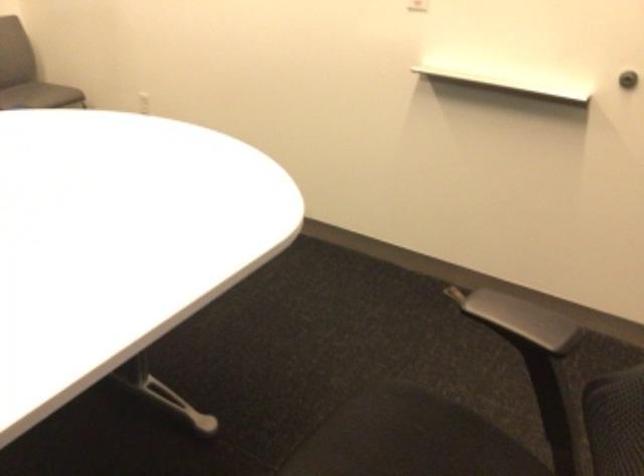
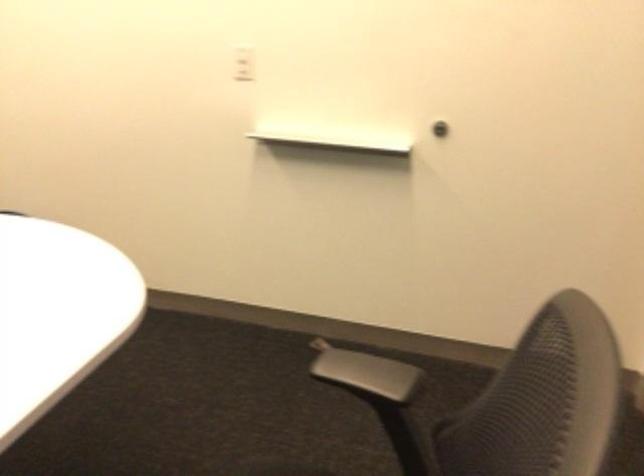
Question: The images are taken continuously from a first-person perspective. In which direction are you moving?

Choices:
 (A) Left
 (B) Right
 (C) Forward
 (D) Backward

Answer: (B)